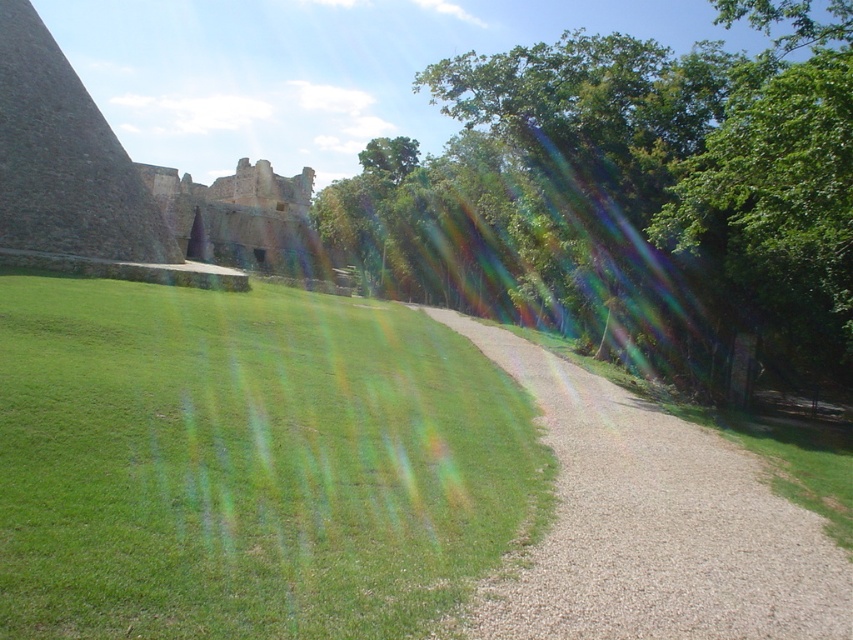
Question: Which point is closer to the camera taking this photo?

Choices:
 (A) (846, 332)
 (B) (589, 600)
 (C) (282, 589)

Answer: (C)

Question: Which is farther from the gravelly dirt path at center?

Choices:
 (A) stone wall at upper left
 (B) green grassy at lower left
 (C) green leafy tree at center

Answer: (C)

Question: Is green leafy tree at center positioned at the back of stone wall at upper left?

Choices:
 (A) no
 (B) yes

Answer: (A)

Question: Is green grassy at lower left below gravelly dirt path at center?

Choices:
 (A) yes
 (B) no

Answer: (B)

Question: Which object appears closest to the camera in this image?

Choices:
 (A) stone wall at upper left
 (B) green grassy at lower left

Answer: (B)

Question: Can you confirm if gravelly dirt path at center is bigger than stone wall at upper left?

Choices:
 (A) yes
 (B) no

Answer: (B)